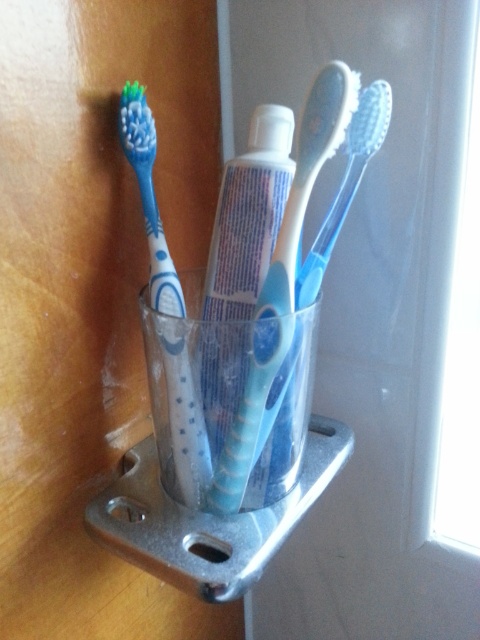
Which is behind, point (264, 106) or point (184, 456)?

The point (264, 106) is behind.

Does point (260, 112) come farther from viewer compared to point (132, 106)?

That is False.

Image resolution: width=480 pixels, height=640 pixels. I want to click on blue glossy toothpaste at center, so click(x=249, y=216).

Measure the distance between blue rubber toothbrush at center and camera.

A distance of 19.36 inches exists between blue rubber toothbrush at center and camera.

Find the location of a particular element. This screenshot has width=480, height=640. blue rubber toothbrush at center is located at coordinates (282, 289).

Is blue rubber toothbrush at left smaller than translucent plastic toothbrush at center?

Yes, blue rubber toothbrush at left is smaller than translucent plastic toothbrush at center.

This screenshot has height=640, width=480. Describe the element at coordinates (167, 307) in the screenshot. I see `blue rubber toothbrush at left` at that location.

At what (x,y) coordinates should I click in order to perform the action: click on blue rubber toothbrush at left. Please return your answer as a coordinate pair (x, y). Image resolution: width=480 pixels, height=640 pixels. Looking at the image, I should click on (167, 307).